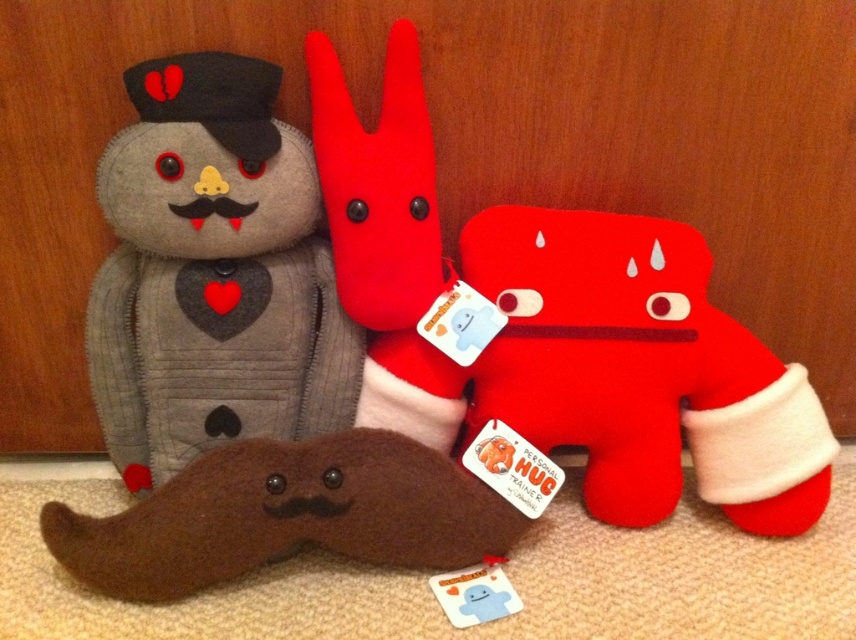
Which is more to the right, brown fuzzy mustache at lower left or velvet plush rabbit at center?

velvet plush rabbit at center is more to the right.

Is brown fuzzy mustache at lower left to the right of velvet plush rabbit at center from the viewer's perspective?

In fact, brown fuzzy mustache at lower left is to the left of velvet plush rabbit at center.

Is point (449, 566) positioned in front of point (383, 186)?

No, it is behind (383, 186).

Identify the location of brown fuzzy mustache at lower left. The height and width of the screenshot is (640, 856). (286, 515).

Between point (603, 515) and point (421, 556), which one is positioned in front?

Point (421, 556) is more forward.

You are a GUI agent. You are given a task and a screenshot of the screen. Output one action in this format:
    pyautogui.click(x=<x>, y=<y>)
    Task: Click on the matte red plush toy at center
    The image size is (856, 640).
    Given the screenshot: What is the action you would take?
    pyautogui.click(x=639, y=369)

Can you confirm if gray felt bear at left is bigger than brown fuzzy mustache at lower left?

Correct, gray felt bear at left is larger in size than brown fuzzy mustache at lower left.

Describe the element at coordinates (212, 273) in the screenshot. I see `gray felt bear at left` at that location.

You are a GUI agent. You are given a task and a screenshot of the screen. Output one action in this format:
    pyautogui.click(x=<x>, y=<y>)
    Task: Click on the gray felt bear at left
    
    Given the screenshot: What is the action you would take?
    pyautogui.click(x=212, y=273)